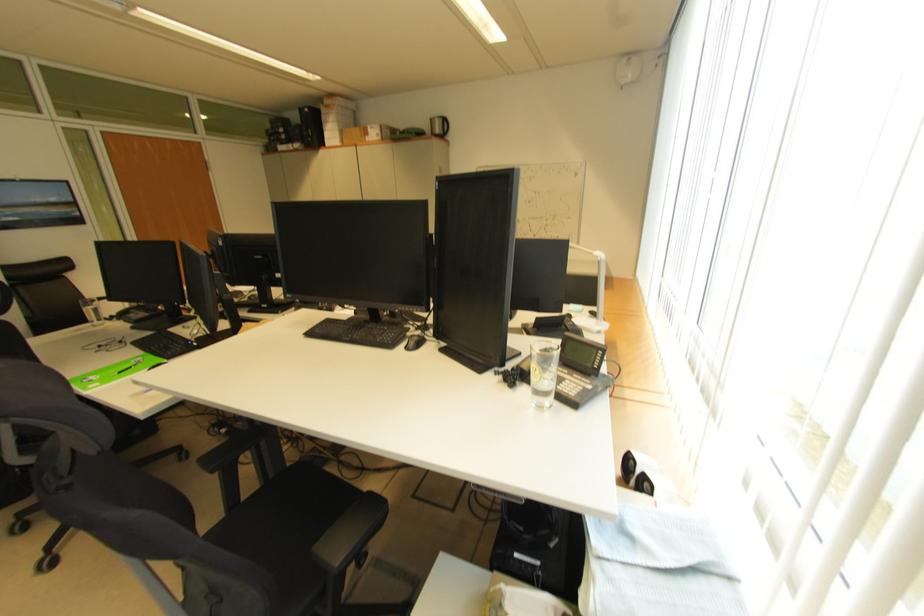
What are the coordinates of `black kettle handle` in the screenshot? It's located at (551, 321).